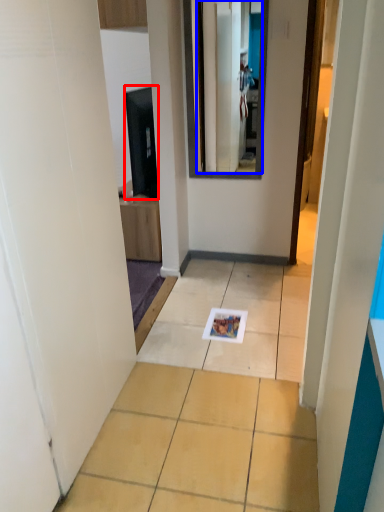
Question: Which point is further to the camera, appliance (highlighted by a red box) or mirror (highlighted by a blue box)?

Choices:
 (A) appliance
 (B) mirror

Answer: (A)